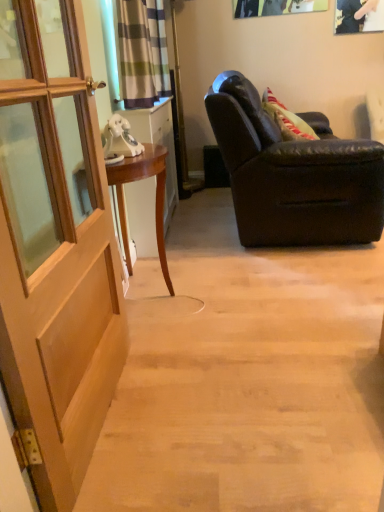
At what (x,y) coordinates should I click in order to perform the action: click on vacant space behind mahogany wood desk at left. Please return your answer as a coordinate pair (x, y). The image size is (384, 512). Looking at the image, I should click on (190, 257).